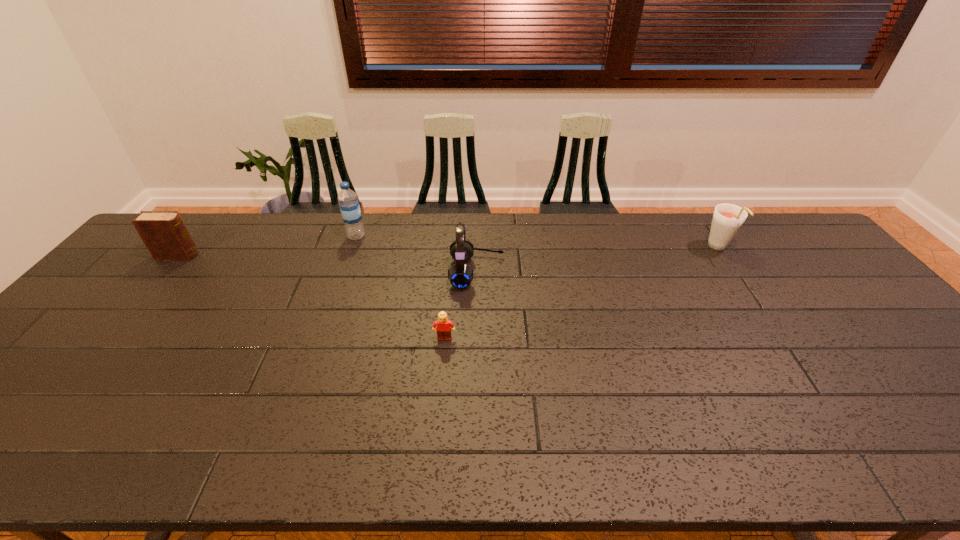
You are a GUI agent. You are given a task and a screenshot of the screen. Output one action in this format:
    pyautogui.click(x=<x>, y=<y>)
    Task: Click on the vacant area at the left edge of the desktop
    This screenshot has width=960, height=540.
    Given the screenshot: What is the action you would take?
    pyautogui.click(x=130, y=278)

This screenshot has width=960, height=540. I want to click on free space at the right edge, so click(873, 342).

Identify the location of vacant area between the water bottle and the headset. (417, 254).

At what (x,y) coordinates should I click in order to perform the action: click on free space between the tallest object and the leftmost object. Please return your answer as a coordinate pair (x, y). The width and height of the screenshot is (960, 540). Looking at the image, I should click on click(267, 246).

This screenshot has width=960, height=540. Find the location of `unoccupied position between the leftmost object and the rightmost object`. unoccupied position between the leftmost object and the rightmost object is located at coordinates (448, 252).

Find the location of `unoccupied area between the Lego and the diary`. unoccupied area between the Lego and the diary is located at coordinates (311, 297).

You are a GUI agent. You are given a task and a screenshot of the screen. Output one action in this format:
    pyautogui.click(x=<x>, y=<y>)
    Task: Click on the free spot between the headset and the water bottle
    
    Given the screenshot: What is the action you would take?
    [417, 254]

I want to click on empty location between the nearest object and the rightmost object, so click(x=582, y=293).

In order to click on free spot between the rightmost object and the shortest object in this screenshot , I will do `click(582, 293)`.

Where is `blank region between the root beer and the diary`? The height and width of the screenshot is (540, 960). blank region between the root beer and the diary is located at coordinates (448, 252).